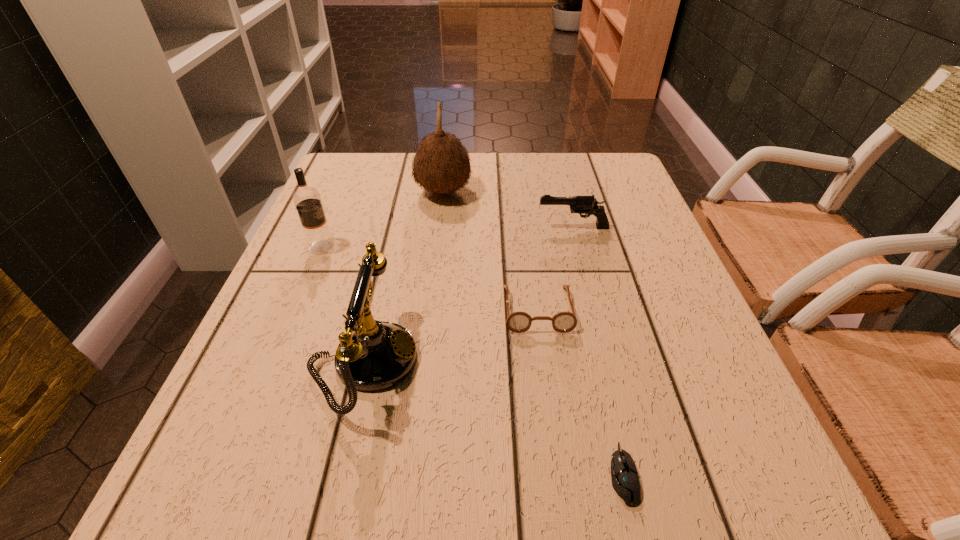
The height and width of the screenshot is (540, 960). I want to click on telephone that is at the left edge, so click(376, 355).

Identify the location of object located at the right edge. (588, 205).

Where is `free space at the far edge`? free space at the far edge is located at coordinates (494, 183).

What are the coordinates of `free point at the near edge` in the screenshot? It's located at (417, 500).

The height and width of the screenshot is (540, 960). In the image, there is a desktop. In order to click on vacant space at the left edge in this screenshot , I will do `click(324, 200)`.

In the image, there is a desktop. Where is `vacant space at the right edge`? vacant space at the right edge is located at coordinates (732, 433).

Locate an element on the screen. Image resolution: width=960 pixels, height=540 pixels. vacant area at the far left corner is located at coordinates (381, 167).

I want to click on vacant space at the near left corner of the desktop, so click(x=246, y=475).

This screenshot has width=960, height=540. Find the location of `blank area at the far right corner`. blank area at the far right corner is located at coordinates (600, 163).

Locate an element on the screen. Image resolution: width=960 pixels, height=540 pixels. vacant space that is in between the coconut and the computer mouse is located at coordinates (533, 333).